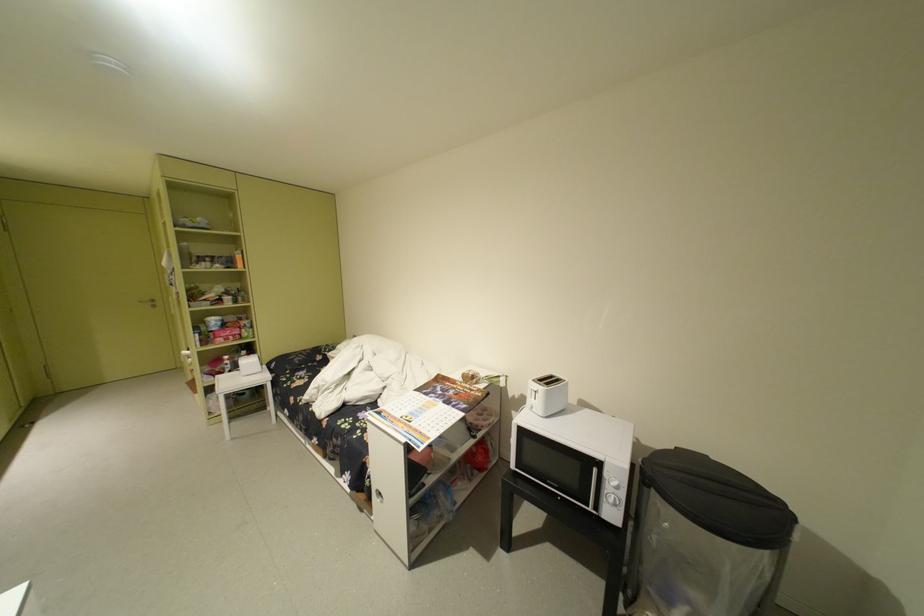
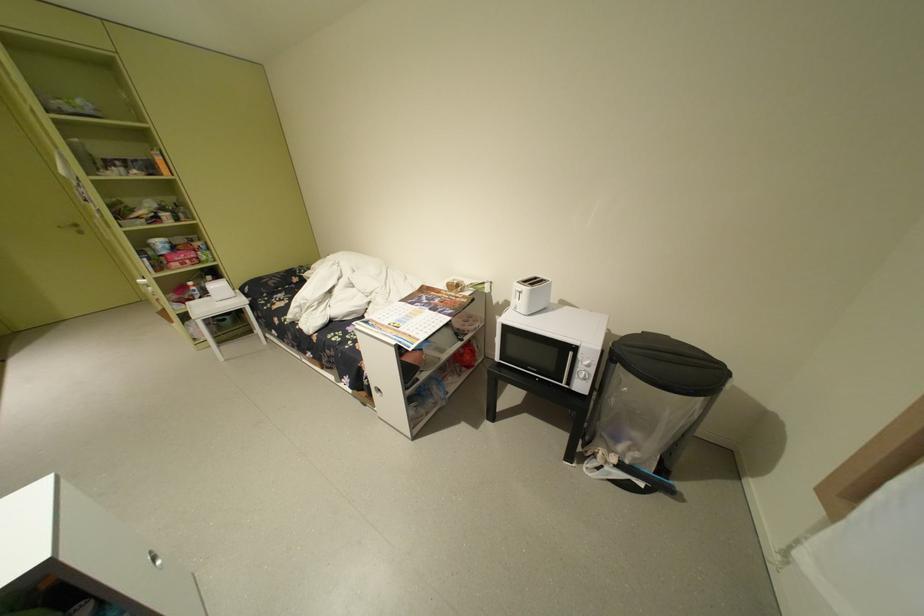
Find the pixel in the second image that matches [606,469] in the first image.

(581, 354)